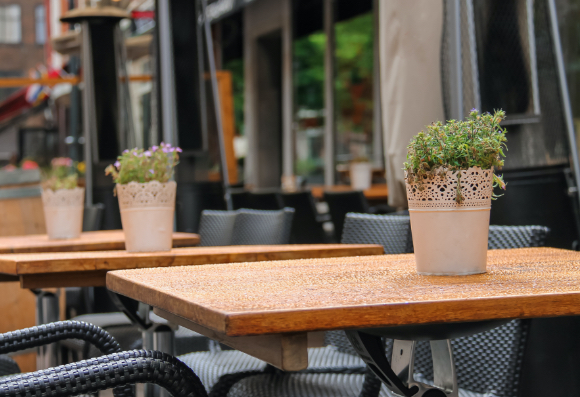
At what (x,y) coordinates should I click in order to perform the action: click on chair seat. Please return your answer as a coordinate pair (x, y). This screenshot has width=580, height=397. Looking at the image, I should click on (345, 380), (229, 363), (113, 321), (333, 360).